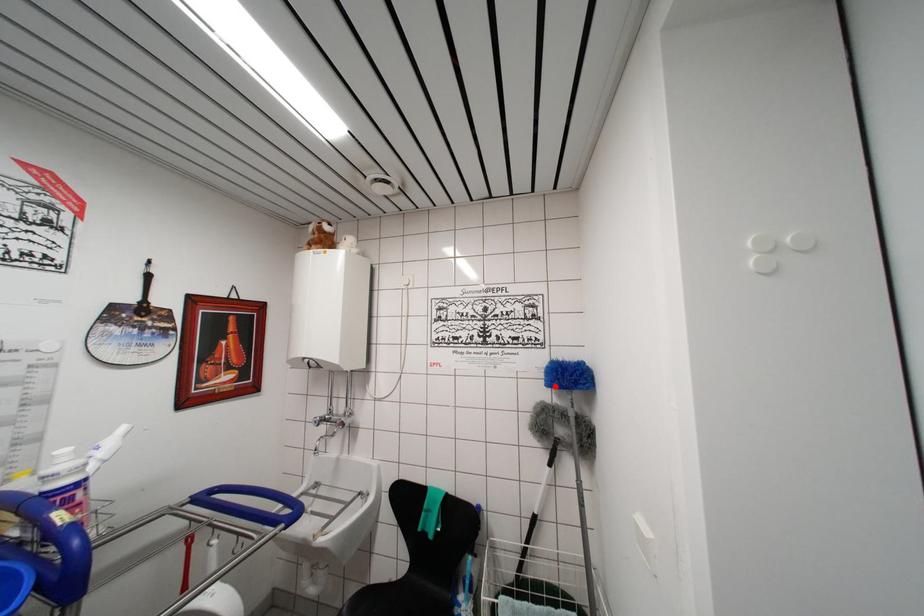
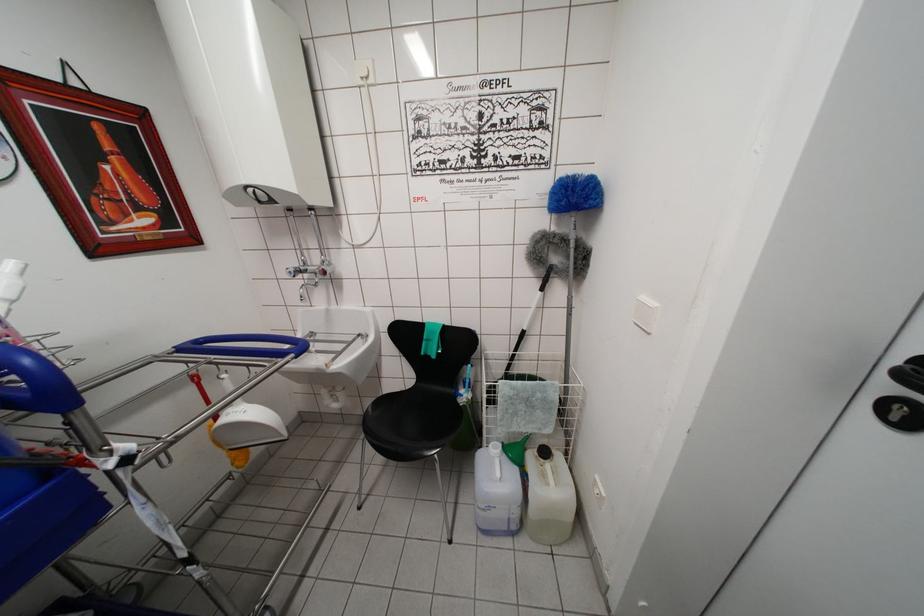
Question: I am providing you with two images of the same scene from different viewpoints. Image1 has a red point marked. In image2, the corresponding 3D location appears at what relative position? Reply with the corresponding letter.

Choices:
 (A) Closer
 (B) Farther

Answer: (A)